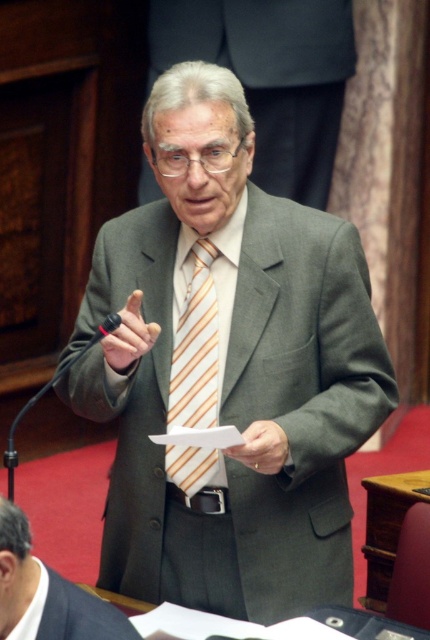
Question: Which object is the farthest from the gray suit at center?

Choices:
 (A) gray wool suit at center
 (B) matte gray suit at center

Answer: (A)

Question: Considering the relative positions of matte gray suit at center and gray suit at center in the image provided, where is matte gray suit at center located with respect to gray suit at center?

Choices:
 (A) right
 (B) left

Answer: (A)

Question: Among these points, which one is farthest from the camera?

Choices:
 (A) (199, 321)
 (B) (270, 308)
 (C) (15, 513)
 (D) (239, 52)

Answer: (D)

Question: Is matte gray suit at center positioned at the back of gray suit at center?

Choices:
 (A) yes
 (B) no

Answer: (A)

Question: Is matte gray suit at center to the left of striped fabric tie at center from the viewer's perspective?

Choices:
 (A) yes
 (B) no

Answer: (B)

Question: Which object appears closest to the camera in this image?

Choices:
 (A) matte gray suit at center
 (B) gray suit at center
 (C) striped fabric tie at center
 (D) gray wool suit at center

Answer: (B)